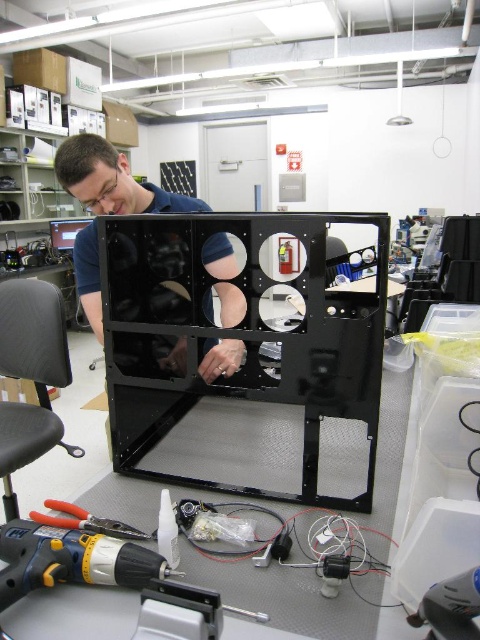
Between matte black shirt at center and yellow plastic drill at lower left, which one appears on the right side from the viewer's perspective?

From the viewer's perspective, matte black shirt at center appears more on the right side.

Is point (205, 253) positioned behind point (19, 568)?

Yes, point (205, 253) is farther from viewer.

The image size is (480, 640). What do you see at coordinates (111, 180) in the screenshot?
I see `matte black shirt at center` at bounding box center [111, 180].

Image resolution: width=480 pixels, height=640 pixels. I want to click on matte black shirt at center, so point(111,180).

Who is positioned more to the left, matte black shirt at center or yellow plastic pliers at lower left?

Positioned to the left is yellow plastic pliers at lower left.

Who is more forward, (122, 195) or (60, 509)?

Positioned in front is point (60, 509).

Which is behind, point (157, 204) or point (37, 515)?

The point (157, 204) is more distant.

Identify the location of matte black shirt at center. The image size is (480, 640). [111, 180].

Which is above, yellow plastic drill at lower left or yellow plastic pliers at lower left?

yellow plastic pliers at lower left is higher up.

Is yellow plastic drill at lower left above yellow plastic pliers at lower left?

Actually, yellow plastic drill at lower left is below yellow plastic pliers at lower left.

This screenshot has height=640, width=480. I want to click on yellow plastic drill at lower left, so click(x=71, y=561).